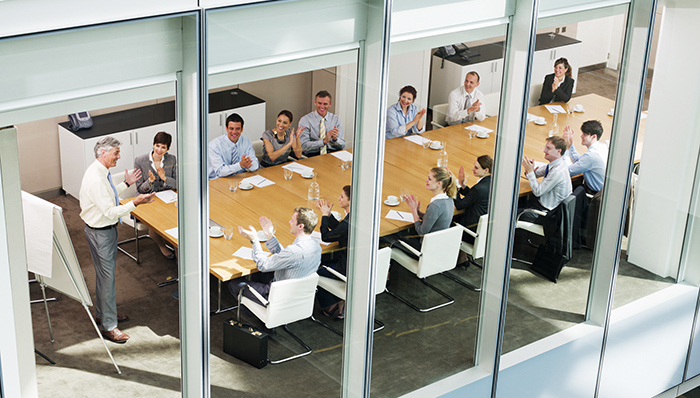
You are a GUI agent. You are given a task and a screenshot of the screen. Output one action in this format:
    pyautogui.click(x=<x>, y=<y>)
    Task: Click on the chair armrest
    The image size is (700, 398).
    Given the screenshot: What is the action you would take?
    pyautogui.click(x=256, y=294), pyautogui.click(x=339, y=273), pyautogui.click(x=410, y=248), pyautogui.click(x=472, y=230), pyautogui.click(x=441, y=124), pyautogui.click(x=539, y=212)